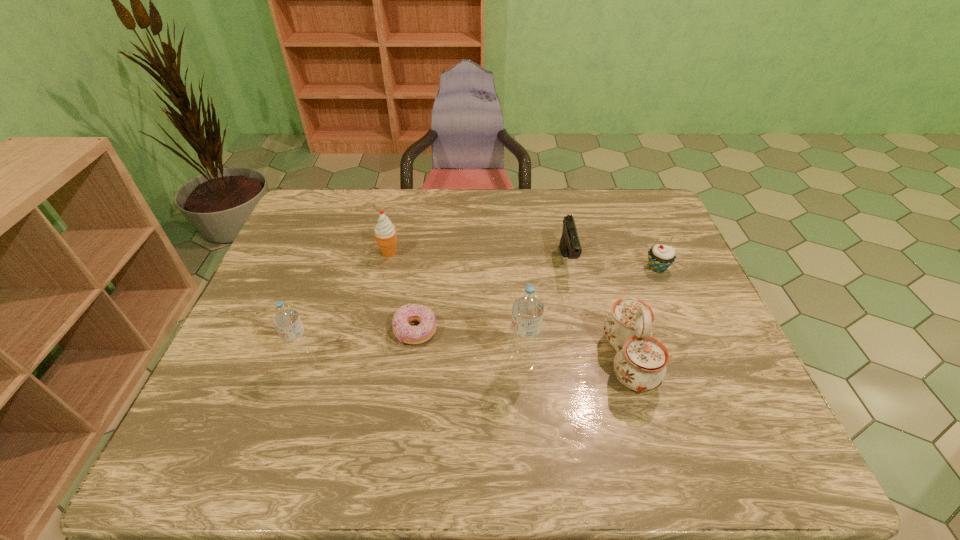
Locate an element on the screen. The height and width of the screenshot is (540, 960). vacant space that is in between the second tallest object and the cupcake is located at coordinates (481, 314).

I want to click on unoccupied area between the shortest object and the shorter water bottle, so click(x=360, y=346).

Locate an element on the screen. The width and height of the screenshot is (960, 540). object that can be found as the sixth closest to the rightmost object is located at coordinates (285, 317).

Select which object appears as the second closest to the shortest object. Please provide its 2D coordinates. Your answer should be formatted as a tuple, i.e. [(x, y)], where the tuple contains the x and y coordinates of a point satisfying the conditions above.

[(528, 306)]

Image resolution: width=960 pixels, height=540 pixels. Identify the location of free space in the image that satisfies the following two spatial constraints: 1. on the back side of the fourth object from right to left; 2. on the right side of the rightmost object. (515, 268).